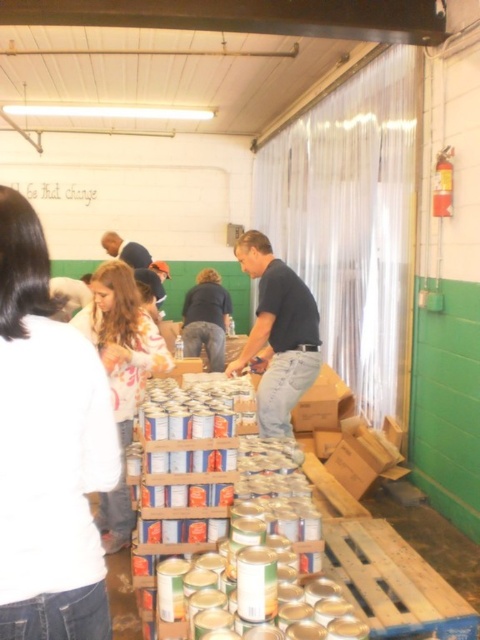
You are standing in the warehouse and want to move from the point at coordinates (301, 388) to the point at coordinates (204, 321). Based on the scene description, which direction should you move to reach your destination?

You should move backward because point (301, 388) is in front of point (204, 321), so moving backward will take you towards the latter.